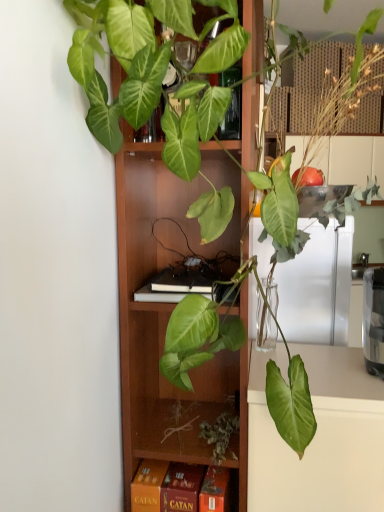
What do you see at coordinates (179, 488) in the screenshot?
I see `orange matte board game at lower center` at bounding box center [179, 488].

Find the location of a particular element. The width and height of the screenshot is (384, 512). orange matte board game at lower center is located at coordinates (179, 488).

The image size is (384, 512). What do you see at coordinates (168, 319) in the screenshot?
I see `wooden cabinet at center` at bounding box center [168, 319].

This screenshot has height=512, width=384. What are the coordinates of `wooden cabinet at center` in the screenshot? It's located at (168, 319).

Locate an element on the screen. This screenshot has height=512, width=384. orange matte board game at lower center is located at coordinates (179, 488).

From the picture: Which is more to the right, wooden cabinet at center or orange matte board game at lower center?

From the viewer's perspective, wooden cabinet at center appears more on the right side.

Is wooden cabinet at center further to the viewer compared to orange matte board game at lower center?

No.

Is point (157, 390) closer or farther from the camera than point (157, 461)?

Point (157, 390) is positioned farther from the camera compared to point (157, 461).

From the picture: From the image's perspective, which one is positioned higher, wooden cabinet at center or orange matte board game at lower center?

From the image's view, wooden cabinet at center is above.

From a real-world perspective, who is located higher, wooden cabinet at center or orange matte board game at lower center?

A: wooden cabinet at center, from a real-world perspective.

Considering the relative sizes of wooden cabinet at center and orange matte board game at lower center in the image provided, is wooden cabinet at center thinner than orange matte board game at lower center?

No, wooden cabinet at center is not thinner than orange matte board game at lower center.

Is wooden cabinet at center taller or shorter than orange matte board game at lower center?

Clearly, wooden cabinet at center is taller compared to orange matte board game at lower center.

Considering the relative sizes of wooden cabinet at center and orange matte board game at lower center in the image provided, is wooden cabinet at center bigger than orange matte board game at lower center?

Yes.

Is wooden cabinet at center not within orange matte board game at lower center?

Yes, wooden cabinet at center is outside of orange matte board game at lower center.

Is wooden cabinet at center next to orange matte board game at lower center and touching it?

wooden cabinet at center is not next to orange matte board game at lower center, and they're not touching.

Is wooden cabinet at center oriented towards orange matte board game at lower center?

Yes, wooden cabinet at center is oriented towards orange matte board game at lower center.

Locate an element on the screen. This screenshot has height=512, width=384. paperback book behind the wooden cabinet at center is located at coordinates (179, 488).

Is orange matte board game at lower center to the right of wooden cabinet at center from the viewer's perspective?

In fact, orange matte board game at lower center is to the left of wooden cabinet at center.

Which object is further away from the camera taking this photo, orange matte board game at lower center or wooden cabinet at center?

Positioned behind is orange matte board game at lower center.

Does point (144, 480) appear closer or farther from the camera than point (193, 232)?

Clearly, point (144, 480) is closer to the camera than point (193, 232).

From the image's perspective, is orange matte board game at lower center on top of wooden cabinet at center?

No, from the image's perspective, orange matte board game at lower center is not above wooden cabinet at center.

From a real-world perspective, is orange matte board game at lower center physically located above or below wooden cabinet at center?

orange matte board game at lower center is situated lower than wooden cabinet at center in the real world.

Is orange matte board game at lower center thinner than wooden cabinet at center?

Indeed, orange matte board game at lower center has a lesser width compared to wooden cabinet at center.

Does orange matte board game at lower center have a lesser height compared to wooden cabinet at center?

Yes.

Based on their sizes in the image, would you say orange matte board game at lower center is bigger or smaller than wooden cabinet at center?

In the image, orange matte board game at lower center appears to be smaller than wooden cabinet at center.

Do you think orange matte board game at lower center is within wooden cabinet at center, or outside of it?

orange matte board game at lower center lies within the bounds of wooden cabinet at center.

Is orange matte board game at lower center positioned far away from wooden cabinet at center?

No.

Is orange matte board game at lower center facing away from wooden cabinet at center?

Correct, orange matte board game at lower center is looking away from wooden cabinet at center.

What's the angular difference between orange matte board game at lower center and wooden cabinet at center's facing directions?

The angle between the facing direction of orange matte board game at lower center and the facing direction of wooden cabinet at center is 1.54 degrees.

Measure the distance from orange matte board game at lower center to wooden cabinet at center.

orange matte board game at lower center and wooden cabinet at center are 12.06 inches apart.

The image size is (384, 512). What are the coordinates of `cabinet above the orange matte board game at lower center (from a real-world perspective)` in the screenshot? It's located at (168, 319).

This screenshot has height=512, width=384. I want to click on paperback book behind the wooden cabinet at center, so 179,488.

Locate an element on the screen. The image size is (384, 512). cabinet in front of the orange matte board game at lower center is located at coordinates (168, 319).